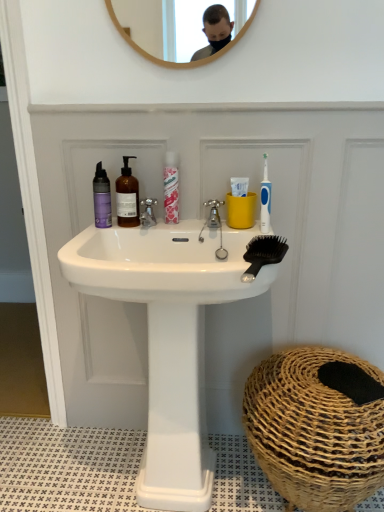
Locate an element on the screen. This screenshot has height=512, width=384. vacant space underneath white glossy sink at center (from a real-world perspective) is located at coordinates (178, 503).